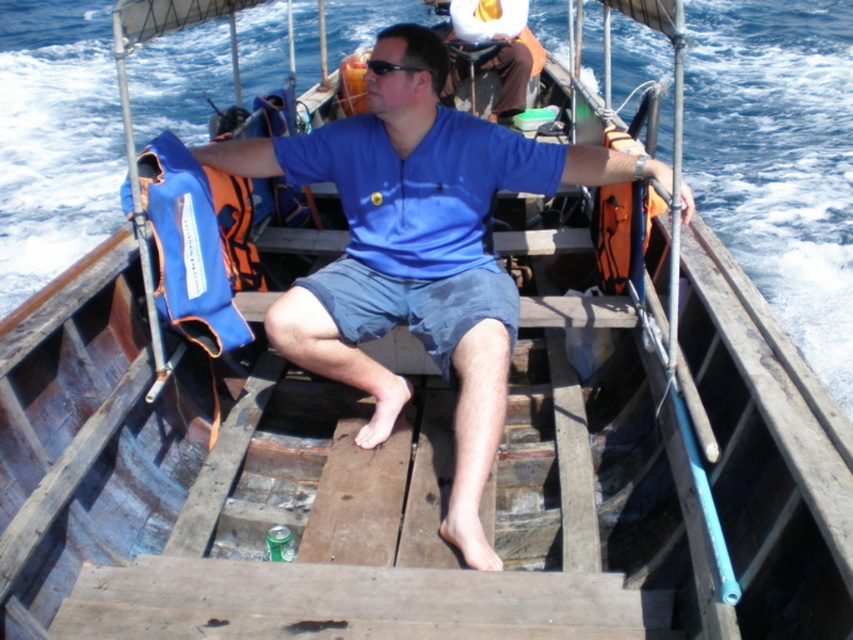
You are a safety inspector checking the boat for proper equipment placement. The orange fabric life jacket at right must be easily accessible to the user. Is it positioned correctly relative to the black plastic sunglasses at center?

The orange fabric life jacket at right is to the right of the black plastic sunglasses at center, which means it is positioned correctly as it is within easy reach of the user.